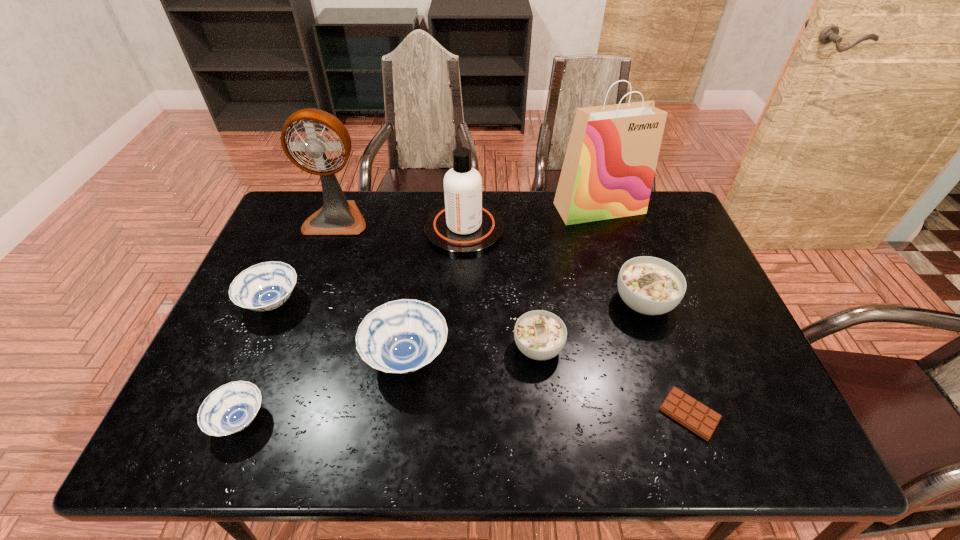
You are a GUI agent. You are given a task and a screenshot of the screen. Output one action in this format:
    pyautogui.click(x=<x>, y=<y>)
    Task: Click on the seventh closest object relative to the brown fan
    This screenshot has height=540, width=960.
    Given the screenshot: What is the action you would take?
    pyautogui.click(x=649, y=285)

Locate an element on the screen. object that is the seventh closest one to the brown fan is located at coordinates (649, 285).

You are a GUI agent. You are given a task and a screenshot of the screen. Output one action in this format:
    pyautogui.click(x=<x>, y=<y>)
    Task: Click on the fourth closest soup bowl to the shopping bag
    The width and height of the screenshot is (960, 540).
    Given the screenshot: What is the action you would take?
    pyautogui.click(x=266, y=286)

Locate an element on the screen. The width and height of the screenshot is (960, 540). soup bowl that is the third closest to the shortest soup bowl is located at coordinates (540, 335).

I want to click on the second closest blue soup bowl to the shortest soup bowl, so click(x=266, y=286).

Locate an element on the screen. blue soup bowl that is the nearest to the candy bar is located at coordinates (402, 336).

Find the location of a particular element. vacant region that satisfies the following two spatial constraints: 1. on the front side of the nearer white soup bowl; 2. on the left side of the candy bar is located at coordinates (545, 414).

You are a GUI agent. You are given a task and a screenshot of the screen. Output one action in this format:
    pyautogui.click(x=<x>, y=<y>)
    Task: Click on the vacant region that satisfies the following two spatial constraints: 1. on the back side of the candy bar; 2. on the left side of the smallest blue soup bowl
    The width and height of the screenshot is (960, 540).
    Given the screenshot: What is the action you would take?
    pyautogui.click(x=243, y=414)

Identify the location of free space that satisfies the following two spatial constraints: 1. on the back side of the rightmost soup bowl; 2. on the left side of the second biggest blue soup bowl. This screenshot has height=540, width=960. (273, 302).